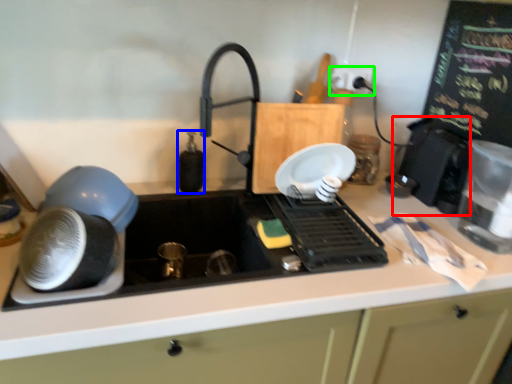
Question: Which object is positioned farthest from appliance (highlighted by a red box)? Select from bottle (highlighted by a blue box) and electric outlet (highlighted by a green box).

Choices:
 (A) bottle
 (B) electric outlet

Answer: (A)